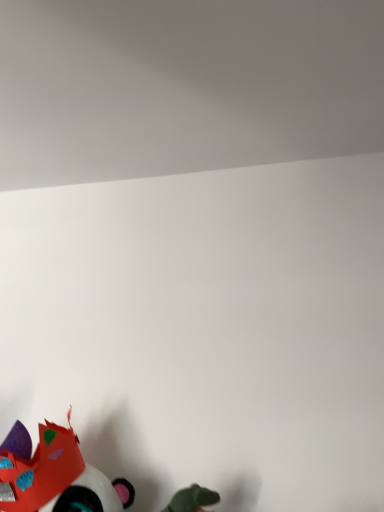
What do you see at coordinates (55, 475) in the screenshot?
I see `matte paper crown at lower left` at bounding box center [55, 475].

I want to click on matte paper crown at lower left, so click(x=55, y=475).

Identify the location of matte paper crown at lower left. (55, 475).